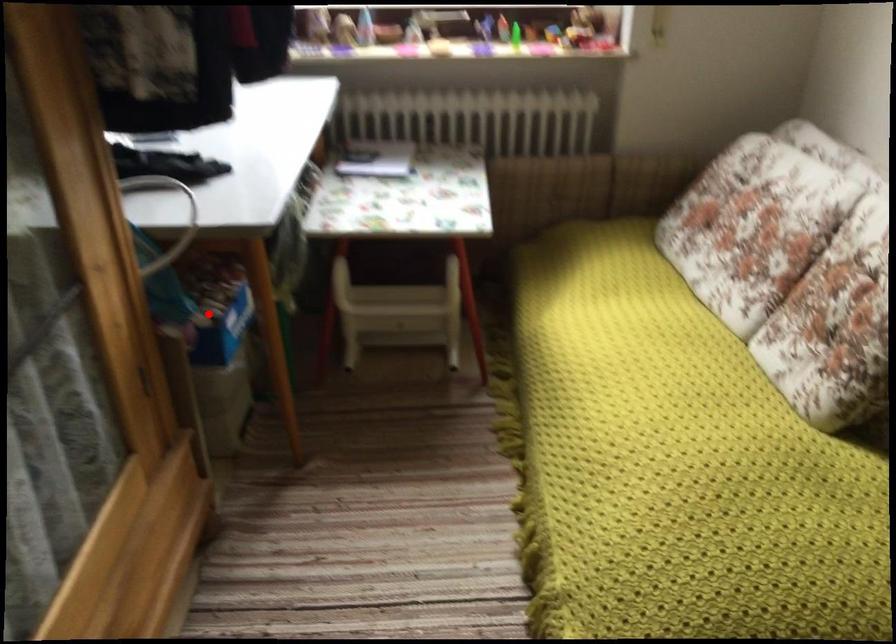
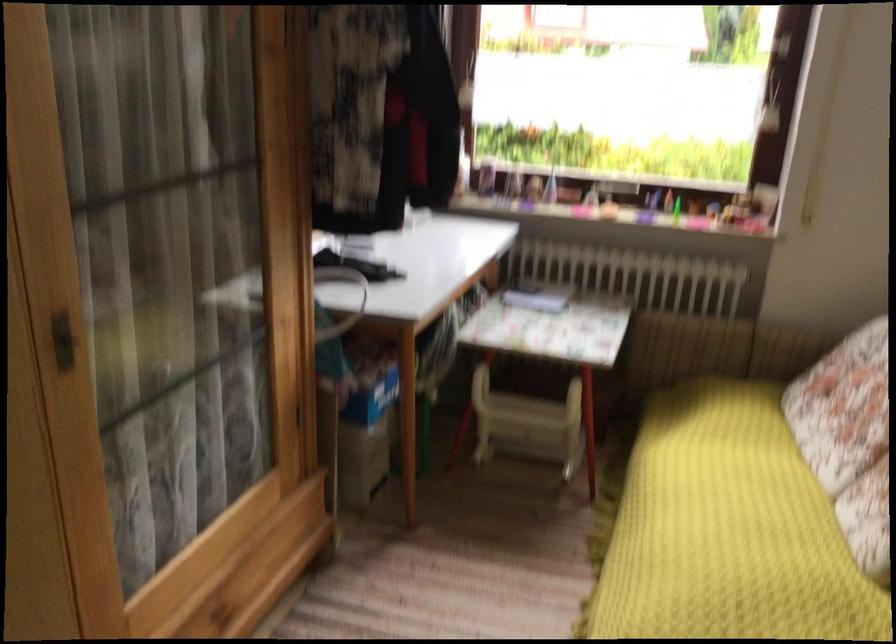
Where in the second image is the point corresponding to the highlighted location from the first image?

(360, 381)